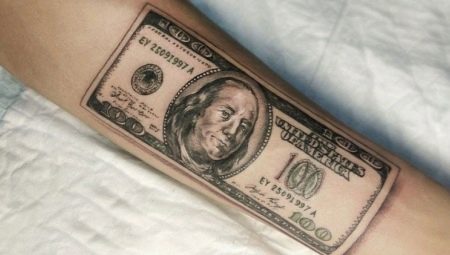
At what (x,y) coordinates should I click in order to perform the action: click on white cloth. Please return your answer as a coordinate pair (x, y). The height and width of the screenshot is (255, 450). Looking at the image, I should click on (136, 237).